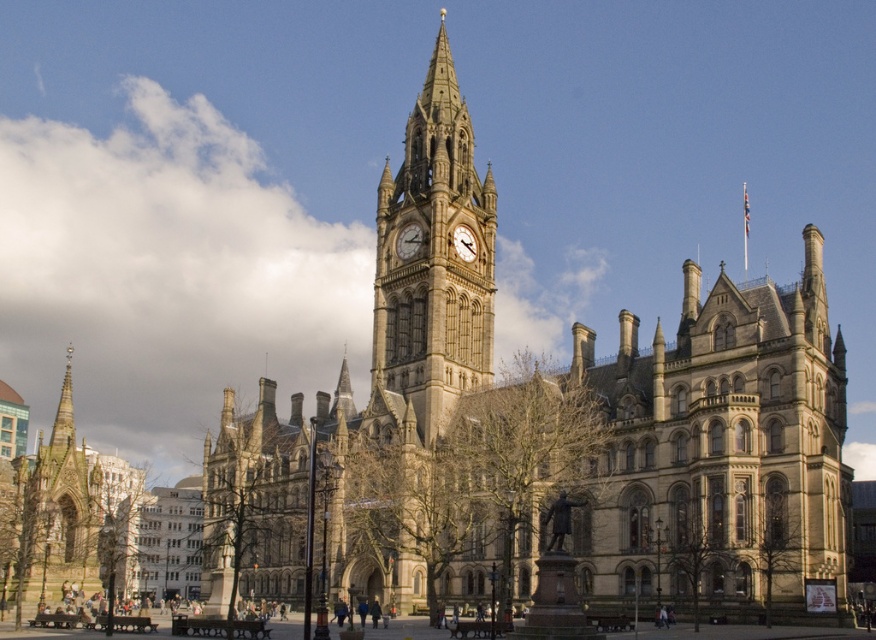
You are a maintenance worker needing to reach both the golden stone clock tower at center and the golden stone clock at center for repairs. Given that your ladder can extend up to 8 meters, can you safely access both objects without moving the ladder?

The golden stone clock tower at center and golden stone clock at center are 8.44 meters apart from each other. Since your ladder only extends up to 8 meters, you cannot safely reach both objects without moving the ladder because the distance between them exceeds the ladder length.

You are an architect analyzing the symmetry of the grand historic building. The building has a central clock tower with a golden stone clock. Based on the coordinates provided, is the golden stone clock at center perfectly centered horizontally and vertically on the building?

The golden stone clock at center is located at coordinates point (408, 241). Since perfect center would be at (438, 320), it is slightly offset to the left and down from the true center.

You are an architect examining the building and need to determine the spatial relationship between the golden stone clock tower at center and the golden stone clock at center. Which one is located above the other?

The golden stone clock tower at center is positioned over the golden stone clock at center, so the tower is above the clock.